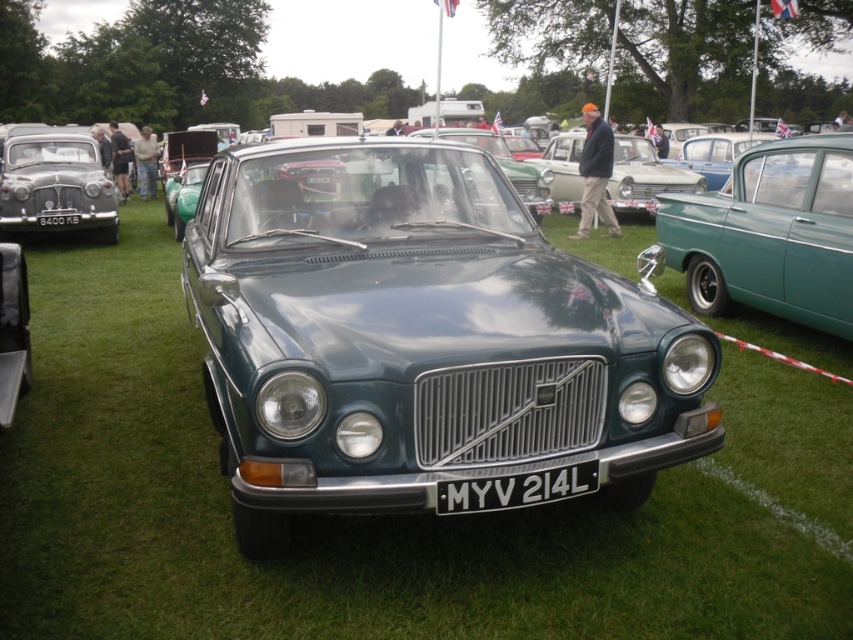
Does teal glossy sedan at right have a lesser height compared to matte silver car at left?

Indeed, teal glossy sedan at right has a lesser height compared to matte silver car at left.

Does teal glossy sedan at right have a greater width compared to matte silver car at left?

No, teal glossy sedan at right is not wider than matte silver car at left.

Which is behind, point (837, 221) or point (10, 170)?

Point (10, 170)

I want to click on teal glossy sedan at right, so click(770, 234).

Who is higher up, metallic blue sedan at center or black metal/license plate at center?

metallic blue sedan at center is higher up.

Between metallic blue sedan at center and black metal/license plate at center, which one appears on the left side from the viewer's perspective?

black metal/license plate at center

This screenshot has height=640, width=853. Describe the element at coordinates (643, 177) in the screenshot. I see `metallic blue sedan at center` at that location.

In order to click on metallic blue sedan at center in this screenshot , I will do `click(643, 177)`.

Can you confirm if teal glossy sedan at right is bigger than metallic blue sedan at center?

Actually, teal glossy sedan at right might be smaller than metallic blue sedan at center.

Who is lower down, teal glossy sedan at right or metallic blue sedan at center?

Positioned lower is teal glossy sedan at right.

Does point (796, 284) come farther from viewer compared to point (560, 141)?

No.

Where is `teal glossy sedan at right`? This screenshot has height=640, width=853. teal glossy sedan at right is located at coordinates (770, 234).